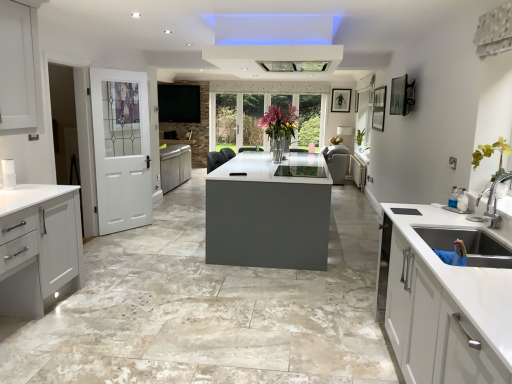
I want to click on vacant area that lies to the right of matte white cabinet at left, the second cabinetry positioned from the top, so click(102, 317).